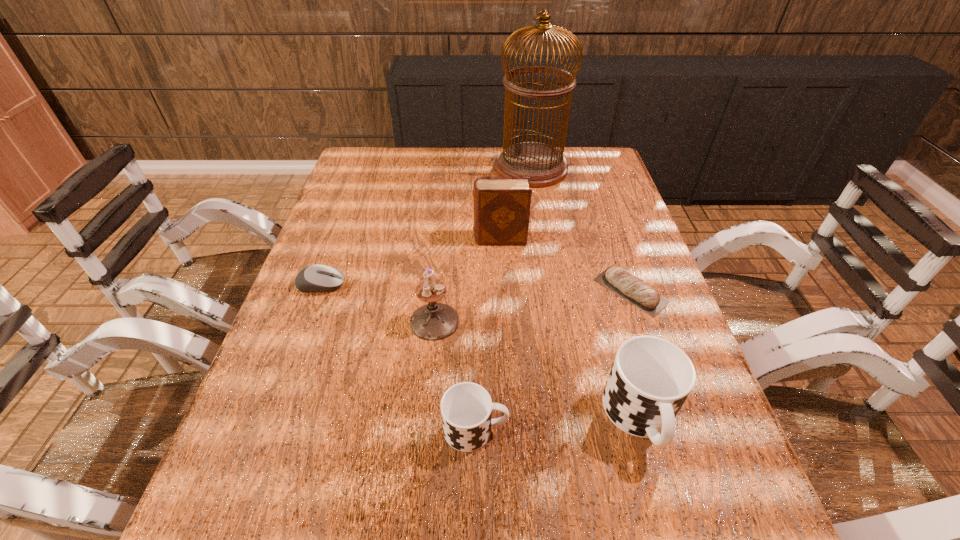
Identify the location of object located in the far edge section of the desktop. Image resolution: width=960 pixels, height=540 pixels. (546, 165).

You are a GUI agent. You are given a task and a screenshot of the screen. Output one action in this format:
    pyautogui.click(x=<x>, y=<y>)
    Task: Click on the object that is at the left edge
    The width and height of the screenshot is (960, 540).
    Given the screenshot: What is the action you would take?
    pyautogui.click(x=315, y=278)

Find the location of a particular element. cup that is at the right edge is located at coordinates (650, 379).

Locate an element on the screen. birdcage situated at the right edge is located at coordinates (546, 165).

Find the location of a particular element. pita bread located in the right edge section of the desktop is located at coordinates (617, 279).

Where is `object located in the far right corner section of the desktop`? object located in the far right corner section of the desktop is located at coordinates (546, 165).

Find the location of `object that is at the near right corner`. object that is at the near right corner is located at coordinates click(x=650, y=379).

Where is `vacant area at the far edge of the desktop`? This screenshot has width=960, height=540. vacant area at the far edge of the desktop is located at coordinates (460, 153).

Where is `free space at the near edge`? Image resolution: width=960 pixels, height=540 pixels. free space at the near edge is located at coordinates [494, 457].

Where is `vacant space at the left edge`? The height and width of the screenshot is (540, 960). vacant space at the left edge is located at coordinates (356, 185).